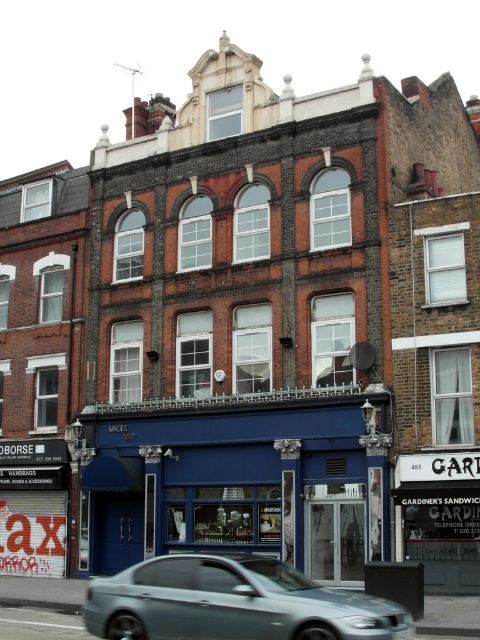
Between point (177, 516) and point (163, 556), which one is positioned in front?

Point (163, 556) is in front.

Is blue matte storefront at center taller than metallic silver sedan at center?

Yes, blue matte storefront at center is taller than metallic silver sedan at center.

Locate an element on the screen. blue matte storefront at center is located at coordinates (240, 477).